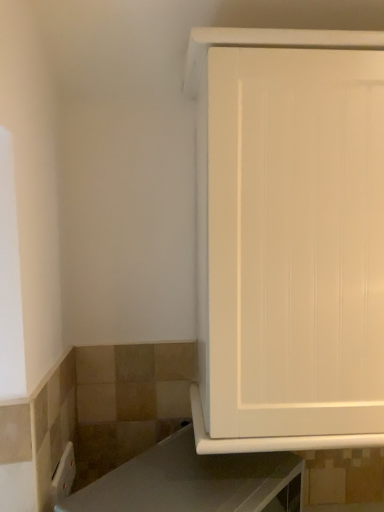
What is the approximate width of white matte cabinet at upper right?

white matte cabinet at upper right is 14.05 inches wide.

What do you see at coordinates (289, 238) in the screenshot? I see `white matte cabinet at upper right` at bounding box center [289, 238].

Find the location of a particular element. white matte cabinet at upper right is located at coordinates (289, 238).

Where is `white glossy countertop at lower right`? Image resolution: width=384 pixels, height=512 pixels. white glossy countertop at lower right is located at coordinates (193, 482).

In order to face white glossy countertop at lower right, should I rotate leftwards or rightwards?

To face it directly, rotate left by 0.702 degrees.

Image resolution: width=384 pixels, height=512 pixels. Describe the element at coordinates (193, 482) in the screenshot. I see `white glossy countertop at lower right` at that location.

Where is `white matte cabinet at upper right`? The width and height of the screenshot is (384, 512). white matte cabinet at upper right is located at coordinates (289, 238).

Visually, is white glossy countertop at lower right positioned to the left or to the right of white matte cabinet at upper right?

In the image, white glossy countertop at lower right appears on the left side of white matte cabinet at upper right.

Considering the positions of objects white glossy countertop at lower right and white matte cabinet at upper right in the image provided, who is behind, white glossy countertop at lower right or white matte cabinet at upper right?

Positioned behind is white matte cabinet at upper right.

Is point (190, 492) more distant than point (235, 340)?

No, it is in front of (235, 340).

From the image's perspective, is white glossy countertop at lower right located above or below white matte cabinet at upper right?

white glossy countertop at lower right is below white matte cabinet at upper right.

From a real-world perspective, is white glossy countertop at lower right above or below white matte cabinet at upper right?

white glossy countertop at lower right is situated lower than white matte cabinet at upper right in the real world.

Is white glossy countertop at lower right wider than white matte cabinet at upper right?

Incorrect, the width of white glossy countertop at lower right does not surpass that of white matte cabinet at upper right.

Between white glossy countertop at lower right and white matte cabinet at upper right, which one has more height?

white matte cabinet at upper right.

Does white glossy countertop at lower right have a larger size compared to white matte cabinet at upper right?

Actually, white glossy countertop at lower right might be smaller than white matte cabinet at upper right.

Is white glossy countertop at lower right not inside white matte cabinet at upper right?

Yes, white glossy countertop at lower right is located beyond the bounds of white matte cabinet at upper right.

Is white glossy countertop at lower right not near white matte cabinet at upper right?

No, there isn't a large distance between white glossy countertop at lower right and white matte cabinet at upper right.

Looking at this image, is white glossy countertop at lower right looking in the opposite direction of white matte cabinet at upper right?

No, white glossy countertop at lower right is not facing away from white matte cabinet at upper right.

What's the angular difference between white glossy countertop at lower right and white matte cabinet at upper right's facing directions?

The angle between the facing direction of white glossy countertop at lower right and the facing direction of white matte cabinet at upper right is 49.7 degrees.

You are a GUI agent. You are given a task and a screenshot of the screen. Output one action in this format:
    pyautogui.click(x=<x>, y=<y>)
    Task: Click on the cabinetry above the white glossy countertop at lower right (from a real-world perspective)
    The width and height of the screenshot is (384, 512).
    Given the screenshot: What is the action you would take?
    pyautogui.click(x=289, y=238)

Is white matte cabinet at upper right to the left or to the right of white glossy countertop at lower right in the image?

Clearly, white matte cabinet at upper right is on the right of white glossy countertop at lower right in the image.

Which object is closer to the camera, white matte cabinet at upper right or white glossy countertop at lower right?

white glossy countertop at lower right is in front.

Does point (369, 246) appear closer or farther from the camera than point (288, 467)?

Point (369, 246) is positioned closer to the camera compared to point (288, 467).

From the image's perspective, would you say white matte cabinet at upper right is shown under white glossy countertop at lower right?

No, from the image's perspective, white matte cabinet at upper right is not beneath white glossy countertop at lower right.

From a real-world perspective, is white matte cabinet at upper right physically below white glossy countertop at lower right?

Incorrect, from a real-world perspective, white matte cabinet at upper right is higher than white glossy countertop at lower right.

Between white matte cabinet at upper right and white glossy countertop at lower right, which one has larger width?

white matte cabinet at upper right is wider.

Consider the image. Who is shorter, white matte cabinet at upper right or white glossy countertop at lower right?

With less height is white glossy countertop at lower right.

Consider the image. Does white matte cabinet at upper right have a smaller size compared to white glossy countertop at lower right?

Actually, white matte cabinet at upper right might be larger than white glossy countertop at lower right.

Is white glossy countertop at lower right a part of white matte cabinet at upper right?

No, white glossy countertop at lower right is not a part of white matte cabinet at upper right.

Would you consider white matte cabinet at upper right to be distant from white glossy countertop at lower right?

No, there isn't a large distance between white matte cabinet at upper right and white glossy countertop at lower right.

Could you tell me if white matte cabinet at upper right is facing white glossy countertop at lower right?

No, white matte cabinet at upper right is not turned towards white glossy countertop at lower right.

Consider the image. How much distance is there between white matte cabinet at upper right and white glossy countertop at lower right?

The distance of white matte cabinet at upper right from white glossy countertop at lower right is 29.85 centimeters.

Find the location of a particular element. The image size is (384, 512). countertop below the white matte cabinet at upper right (from a real-world perspective) is located at coordinates (193, 482).

The height and width of the screenshot is (512, 384). What are the coordinates of `cabinetry behind the white glossy countertop at lower right` in the screenshot? It's located at (289, 238).

Find the location of a particular element. This screenshot has height=512, width=384. cabinetry on the right side of white glossy countertop at lower right is located at coordinates (289, 238).